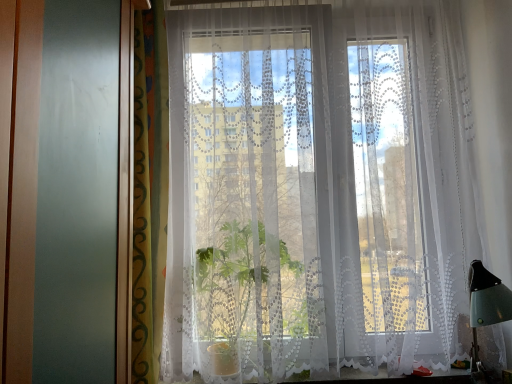
Question: Considering the positions of green patterned curtain at left, arranged as the second curtain when viewed from the right, and white lace curtain at lower center in the image, is green patterned curtain at left, arranged as the second curtain when viewed from the right, taller or shorter than white lace curtain at lower center?

Choices:
 (A) short
 (B) tall

Answer: (B)

Question: Is point (144, 377) closer or farther from the camera than point (360, 382)?

Choices:
 (A) closer
 (B) farther

Answer: (A)

Question: Which object is the farthest from the green patterned curtain at left, the first curtain positioned from the left?

Choices:
 (A) white lace curtain at lower center
 (B) white lace curtain at center, positioned as the 1th curtain in right-to-left order

Answer: (A)

Question: Which object is the farthest from the white lace curtain at lower center?

Choices:
 (A) white lace curtain at center, placed as the 2th curtain when sorted from left to right
 (B) green patterned curtain at left, the first curtain positioned from the left

Answer: (B)